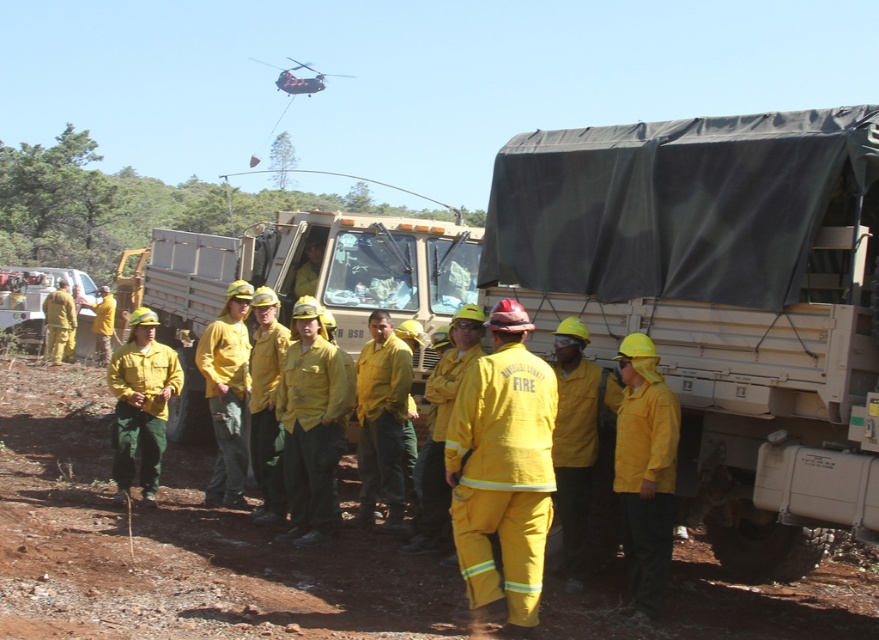
Question: Which point appears farthest from the camera in this image?

Choices:
 (A) (627, 477)
 (B) (147, 266)
 (C) (220, 440)
 (D) (496, 596)

Answer: (B)

Question: Which point is closer to the camera taking this photo?

Choices:
 (A) (135, 356)
 (B) (803, 465)
 (C) (294, 61)

Answer: (B)

Question: Is matte gray trailer truck at right above yellow fireproof suit at center?

Choices:
 (A) yes
 (B) no

Answer: (A)

Question: Which point is farther from the camera taking this photo?

Choices:
 (A) (294, 67)
 (B) (391, 282)
 (C) (631, 416)

Answer: (A)

Question: Does matte gray trailer truck at right have a larger size compared to yellow matte fire jacket at center?

Choices:
 (A) no
 (B) yes

Answer: (B)

Question: Can you confirm if matte gray trailer truck at right is positioned above matte yellow uniform at center?

Choices:
 (A) yes
 (B) no

Answer: (A)